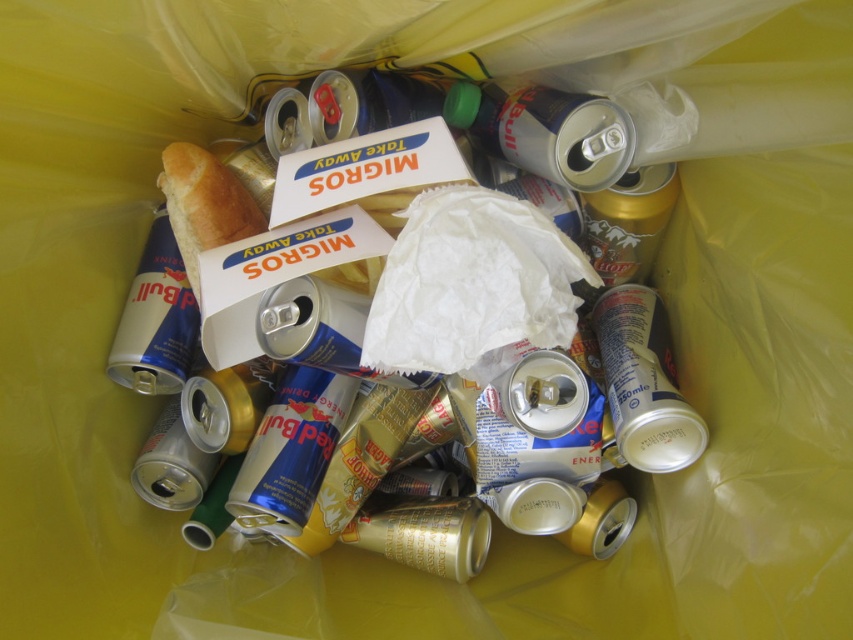
Question: Which object is the farthest from the silver metallic can at center?

Choices:
 (A) silver metallic can at center-right
 (B) blue metallic can at center-left

Answer: (B)

Question: Which of these objects is positioned farthest from the silver metallic can at center-right?

Choices:
 (A) blue metallic can at center-left
 (B) silver metallic can at center

Answer: (A)

Question: Can you confirm if silver metallic can at center is wider than blue metallic can at center-left?

Choices:
 (A) yes
 (B) no

Answer: (A)

Question: Which point is farther from the camera taking this photo?

Choices:
 (A) pos(631,193)
 (B) pos(141,253)

Answer: (B)

Question: Is silver metallic can at center above blue metallic can at center-left?

Choices:
 (A) yes
 (B) no

Answer: (B)

Question: Can you confirm if silver metallic can at center is wider than blue metallic can at center-left?

Choices:
 (A) no
 (B) yes

Answer: (B)